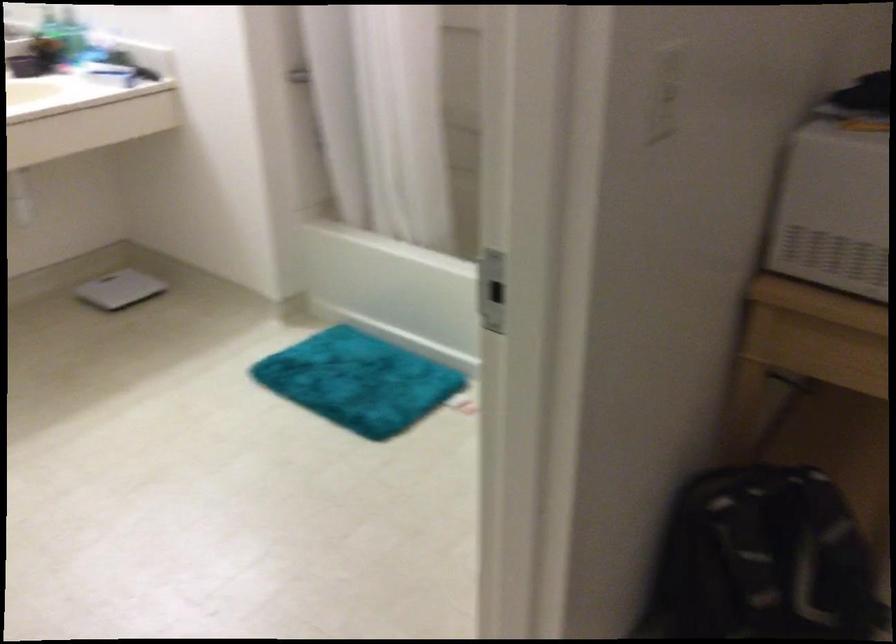
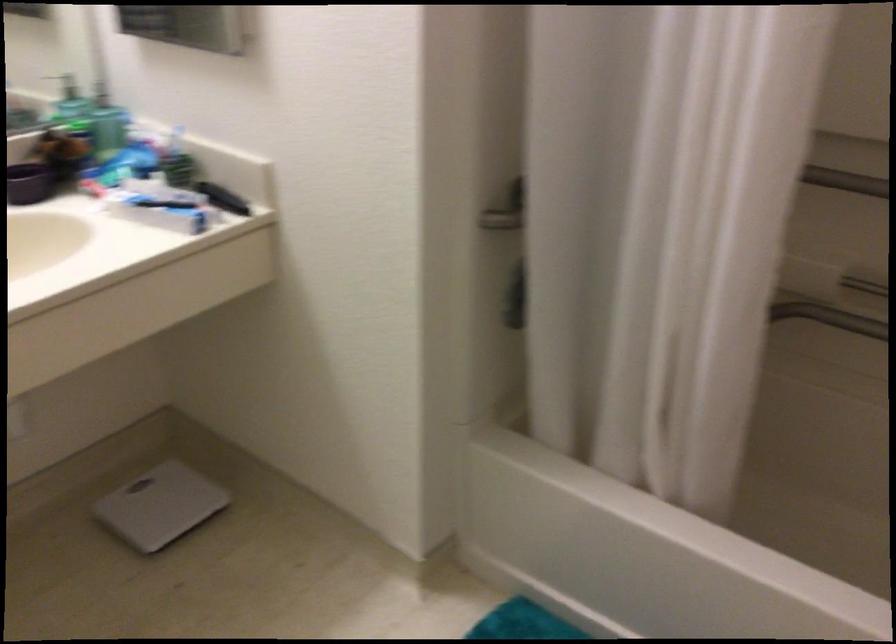
The point at (113, 289) is marked in the first image. Where is the corresponding point in the second image?

(159, 506)